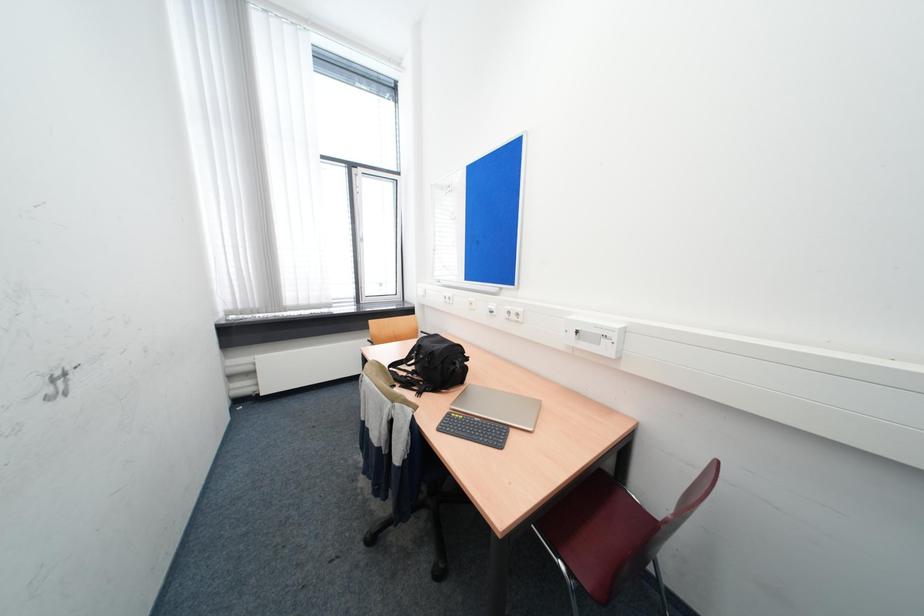
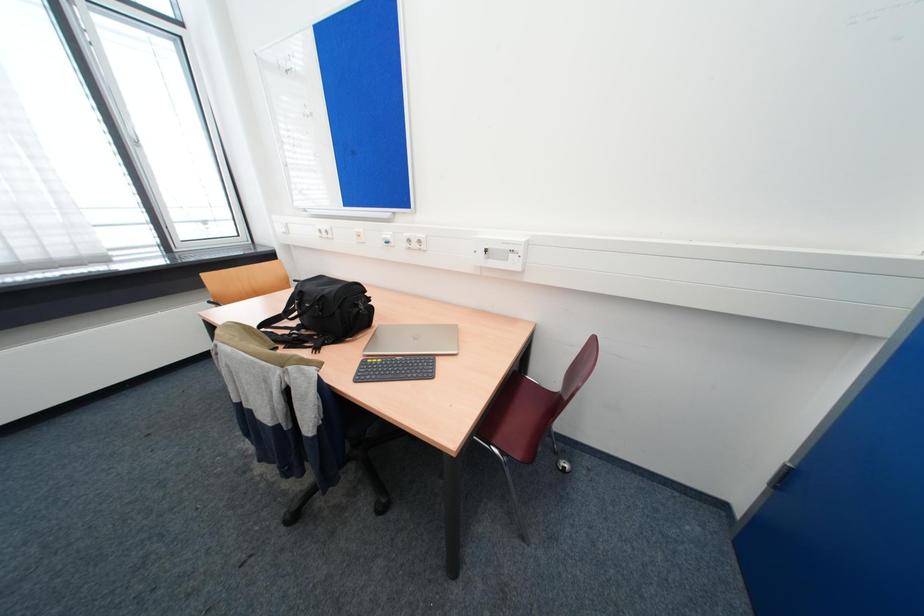
Question: The camera is either moving clockwise (left) or counter-clockwise (right) around the object. The first image is from the beginning of the video and the second image is from the end. Is the camera moving left or right when shooting the video?

Choices:
 (A) Left
 (B) Right

Answer: (A)